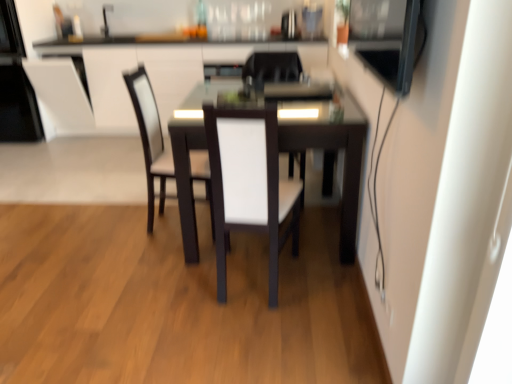
Question: Would you say dark wood table at center is a long distance from white leather chair at center, which is the second chair in back-to-front order?

Choices:
 (A) no
 (B) yes

Answer: (A)

Question: Considering the relative positions of dark wood table at center and white leather chair at center, which ranks as the 2th chair in front-to-back order, in the image provided, is dark wood table at center to the right of white leather chair at center, which ranks as the 2th chair in front-to-back order, from the viewer's perspective?

Choices:
 (A) no
 (B) yes

Answer: (B)

Question: Is dark wood table at center bigger than white leather chair at center, which ranks as the 2th chair in front-to-back order?

Choices:
 (A) no
 (B) yes

Answer: (B)

Question: From a real-world perspective, is dark wood table at center physically below white leather chair at center, which ranks as the 2th chair in front-to-back order?

Choices:
 (A) yes
 (B) no

Answer: (A)

Question: Does dark wood table at center come in front of white leather chair at center, which is the second chair in back-to-front order?

Choices:
 (A) yes
 (B) no

Answer: (A)

Question: Is point (157, 137) positioned closer to the camera than point (15, 130)?

Choices:
 (A) closer
 (B) farther

Answer: (A)

Question: From the image's perspective, relative to black glossy microwave at upper left, marked as the 1th appliance in a left-to-right arrangement, is white leather chair at center, which is the second chair in back-to-front order, above or below?

Choices:
 (A) above
 (B) below

Answer: (B)

Question: Looking at their shapes, would you say white leather chair at center, which is the second chair in back-to-front order, is wider or thinner than black glossy microwave at upper left, marked as the 3th appliance in a right-to-left arrangement?

Choices:
 (A) thin
 (B) wide

Answer: (A)

Question: Based on their sizes in the image, would you say white leather chair at center, which is the second chair in back-to-front order, is bigger or smaller than black glossy microwave at upper left, marked as the 3th appliance in a right-to-left arrangement?

Choices:
 (A) small
 (B) big

Answer: (A)

Question: Which is correct: white fabric chair at center, which is the 3th chair from back to front, is inside black glossy microwave at upper left, marked as the 1th appliance in a left-to-right arrangement, or outside of it?

Choices:
 (A) inside
 (B) outside

Answer: (B)

Question: Looking at the image, does white fabric chair at center, marked as the first chair in a front-to-back arrangement, seem bigger or smaller compared to black glossy microwave at upper left, placed as the 2th appliance when sorted from back to front?

Choices:
 (A) small
 (B) big

Answer: (A)

Question: In terms of height, does white fabric chair at center, which is the 3th chair from back to front, look taller or shorter compared to black glossy microwave at upper left, placed as the 2th appliance when sorted from back to front?

Choices:
 (A) short
 (B) tall

Answer: (A)

Question: Is white fabric chair at center, marked as the first chair in a front-to-back arrangement, in front of or behind black glossy microwave at upper left, marked as the 1th appliance in a left-to-right arrangement, in the image?

Choices:
 (A) behind
 (B) front

Answer: (B)

Question: In terms of size, does black glossy microwave at upper left, marked as the 3th appliance in a right-to-left arrangement, appear bigger or smaller than satin black refrigerator at upper center, the 3th appliance in the front-to-back sequence?

Choices:
 (A) big
 (B) small

Answer: (A)

Question: Relative to satin black refrigerator at upper center, the 3th appliance in the front-to-back sequence, is black glossy microwave at upper left, marked as the 3th appliance in a right-to-left arrangement, in front or behind?

Choices:
 (A) behind
 (B) front

Answer: (B)